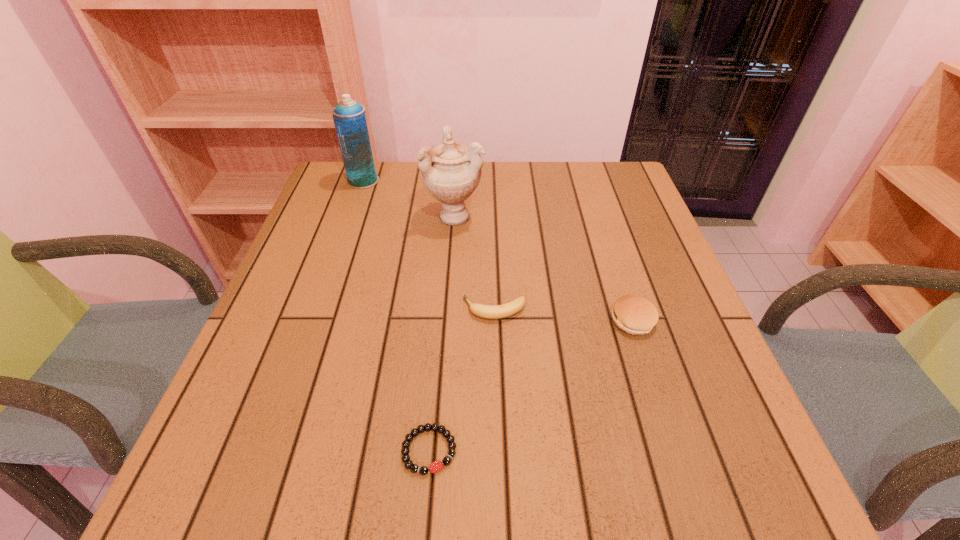
The image size is (960, 540). Identify the location of aerosol can. (349, 118).

Where is `the leftmost object`? the leftmost object is located at coordinates (349, 118).

I want to click on urn, so 451,172.

Find the location of a particular element. This screenshot has width=960, height=540. patty is located at coordinates (636, 315).

Where is `the rightmost object`? the rightmost object is located at coordinates (636, 315).

I want to click on the fourth tallest object, so click(486, 311).

Find the location of a particular element. This screenshot has width=960, height=540. bracelet is located at coordinates (414, 468).

Where is `the nearest object`? the nearest object is located at coordinates (414, 468).

The image size is (960, 540). Identify the location of vacant space situated 0.210m on the right of the farthest object. (451, 181).

This screenshot has height=540, width=960. Identify the location of blank space located 0.330m on the right of the urn. (611, 216).